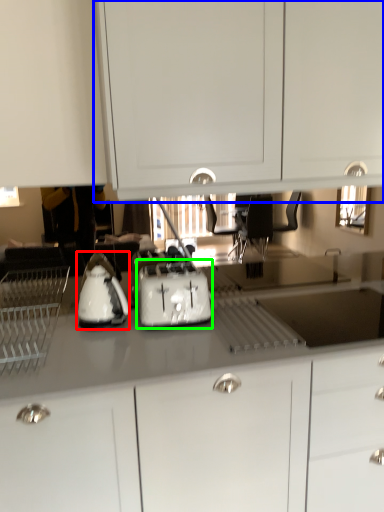
Question: Based on their relative distances, which object is nearer to kitchen appliance (highlighted by a red box)? Choose from cabinetry (highlighted by a blue box) and toaster (highlighted by a green box).

Choices:
 (A) cabinetry
 (B) toaster

Answer: (B)